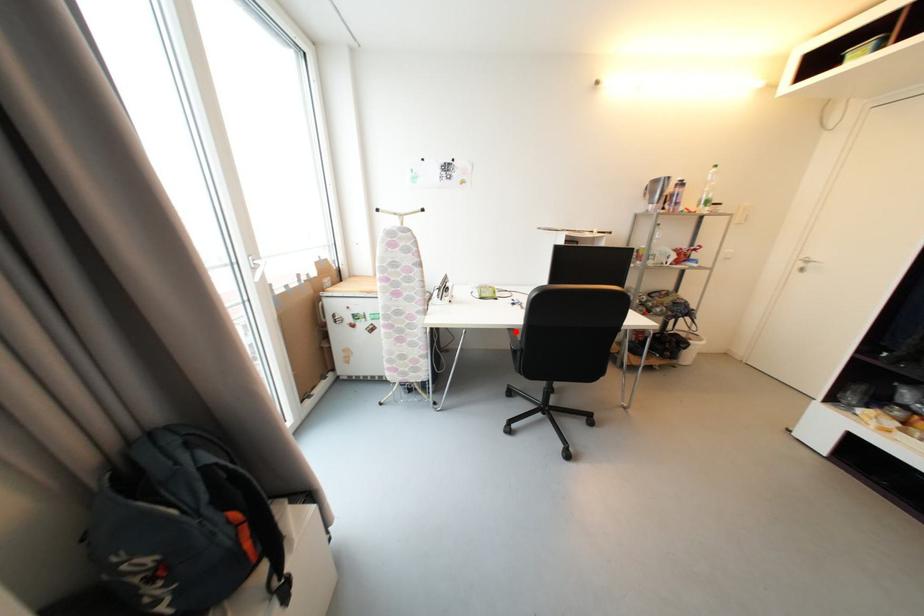
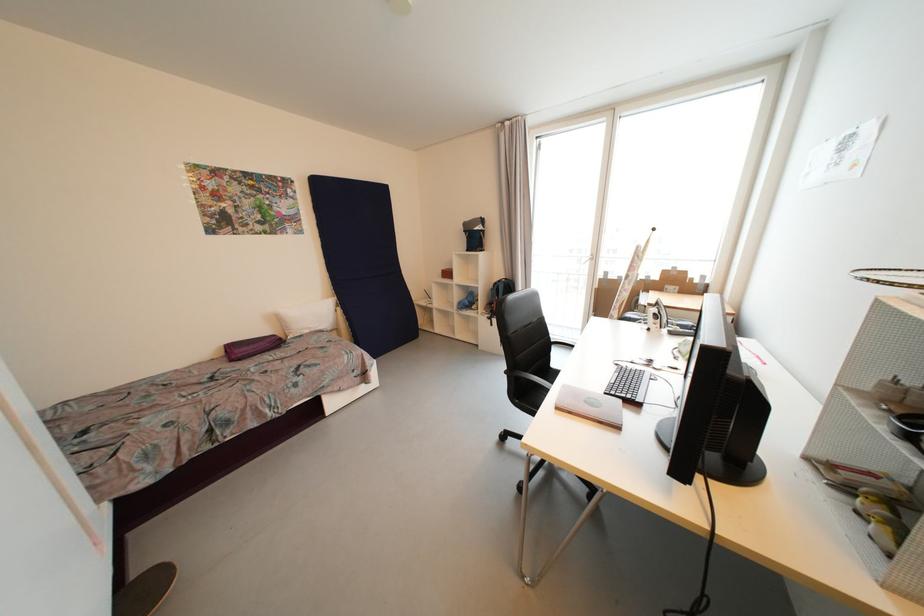
In the second image, find the point that corresponds to the highlighted location in the first image.

(577, 344)